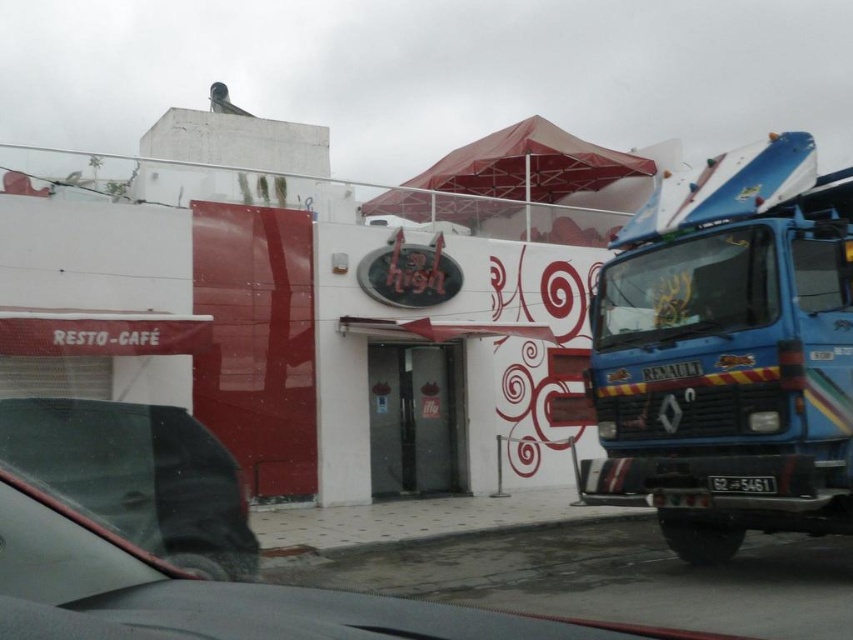
Question: Which of the following is the farthest from the observer?

Choices:
 (A) blue metallic truck at right
 (B) matte black car at lower left
 (C) black plastic license plate at center

Answer: (A)

Question: Which object appears farthest from the camera in this image?

Choices:
 (A) black plastic license plate at center
 (B) matte black car at lower left
 (C) blue metallic truck at right

Answer: (C)

Question: Which point is farther to the camera?

Choices:
 (A) matte black car at lower left
 (B) blue metallic truck at right
 (C) black plastic license plate at center

Answer: (B)

Question: Does blue metallic truck at right appear over black plastic license plate at center?

Choices:
 (A) no
 (B) yes

Answer: (B)

Question: Is blue metallic truck at right positioned before black plastic license plate at center?

Choices:
 (A) yes
 (B) no

Answer: (B)

Question: Is blue metallic truck at right positioned in front of black plastic license plate at center?

Choices:
 (A) yes
 (B) no

Answer: (B)